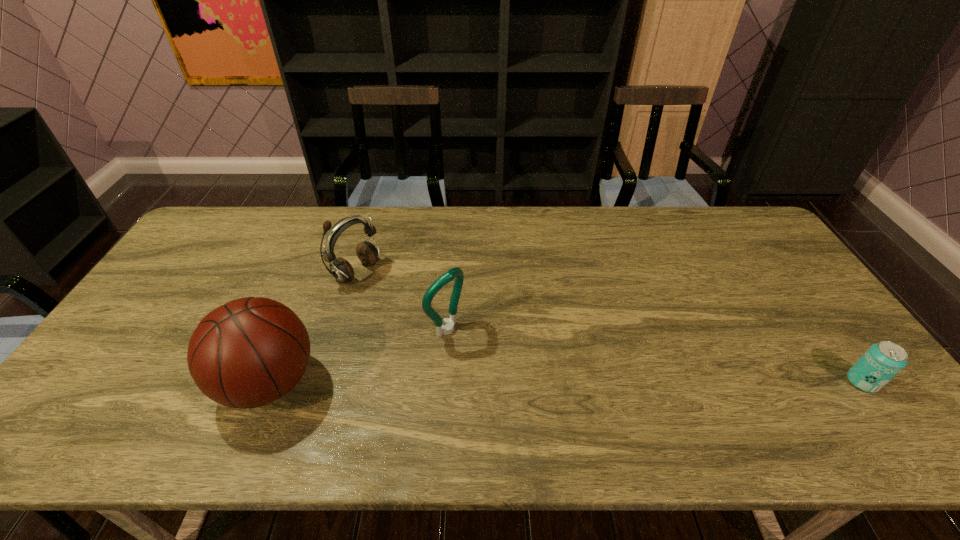
Locate an element on the screen. This screenshot has height=540, width=960. basketball is located at coordinates (249, 352).

Identify the location of beer can. pos(882,361).

The image size is (960, 540). I want to click on the shortest object, so click(882, 361).

The width and height of the screenshot is (960, 540). I want to click on the third object from left to right, so click(448, 327).

Locate an element on the screen. earphone is located at coordinates (340, 268).

Find the location of a particular element. The image size is (960, 540). vacant space situated on the right of the basketball is located at coordinates (469, 383).

You are a GUI agent. You are given a task and a screenshot of the screen. Output one action in this format:
    pyautogui.click(x=<x>, y=<y>)
    Task: Click on the vacant region located 0.380m on the left of the rightmost object
    The height and width of the screenshot is (540, 960).
    Given the screenshot: What is the action you would take?
    pyautogui.click(x=694, y=382)

Identify the location of free spot located at the jaws of the bottle opener. The width and height of the screenshot is (960, 540). (501, 368).

In order to click on vacant space located 0.290m at the jaws of the bottle opener in this screenshot , I will do `click(550, 402)`.

Where is `free space located 0.170m at the jaws of the bottle opener`? This screenshot has height=540, width=960. free space located 0.170m at the jaws of the bottle opener is located at coordinates (510, 374).